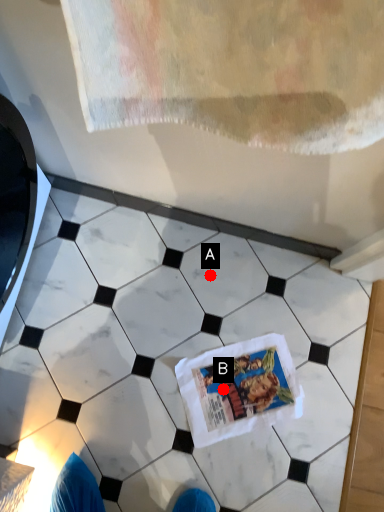
Question: Two points are circled on the image, labeled by A and B beside each circle. Which point is further to the camera?

Choices:
 (A) A is further
 (B) B is further

Answer: (A)